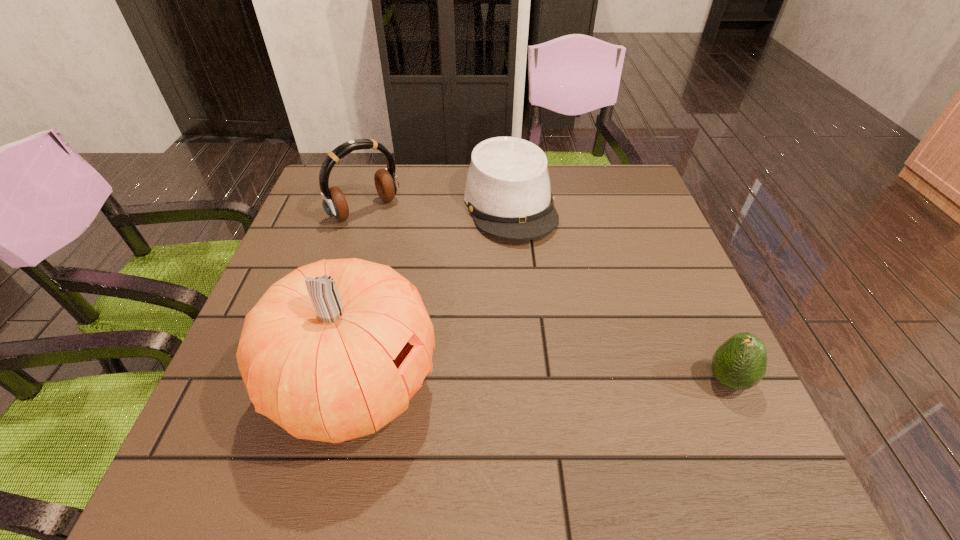
Identify the location of vacant space on the desktop that is between the tallest object and the rightmost object and is positioned on the ear cup of the headset. This screenshot has width=960, height=540. [540, 383].

The height and width of the screenshot is (540, 960). In order to click on free spot on the desktop that is between the pumpkin and the avocado and is positioned on the front-facing side of the hat in this screenshot , I will do `click(583, 382)`.